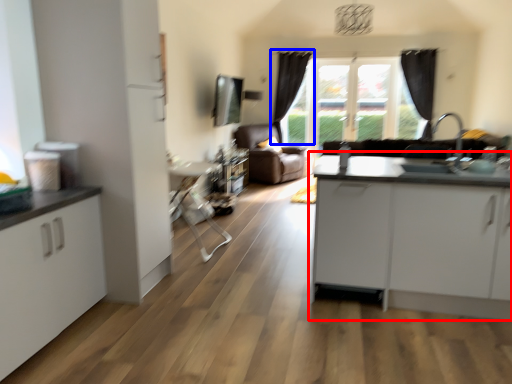
Question: Which of the following is the closest to the observer, table (highlighted by a red box) or curtain (highlighted by a blue box)?

Choices:
 (A) table
 (B) curtain

Answer: (A)